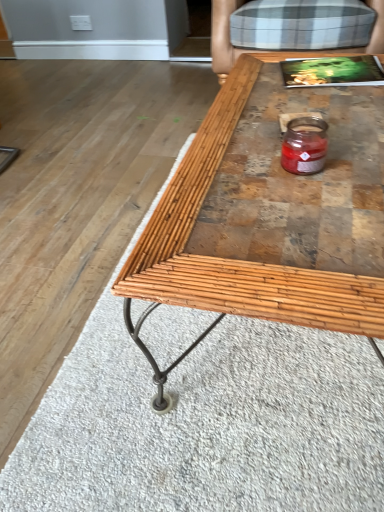
Image resolution: width=384 pixels, height=512 pixels. What are the coordinates of `free spot above bamboo wood coffee table at center (from a real-world perspective)` in the screenshot? It's located at (279, 131).